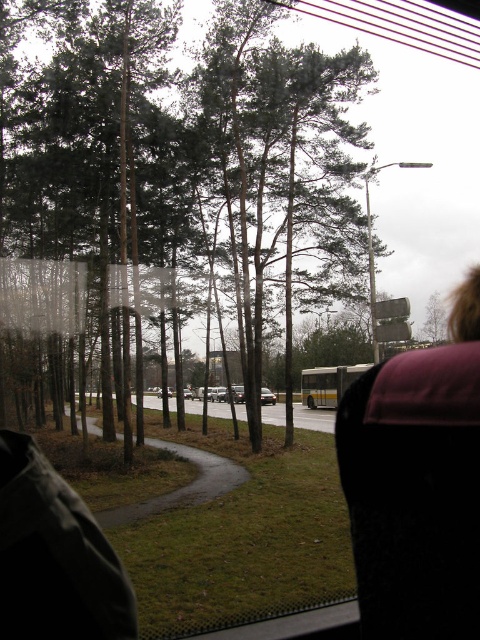
Question: Does maroon fabric at upper right have a larger size compared to yellow metallic bus at center?

Choices:
 (A) no
 (B) yes

Answer: (A)

Question: Which object is farther from the camera taking this photo?

Choices:
 (A) shiny silver sedan at center
 (B) maroon fabric at upper right

Answer: (A)

Question: Is yellow metallic bus at center in front of shiny silver sedan at center?

Choices:
 (A) no
 (B) yes

Answer: (A)

Question: Among these objects, which one is farthest from the camera?

Choices:
 (A) shiny silver sedan at center
 (B) yellow metallic bus at center

Answer: (B)

Question: Does maroon fabric at upper right appear on the right side of yellow metallic bus at center?

Choices:
 (A) yes
 (B) no

Answer: (B)

Question: Which of these objects is positioned closest to the maroon fabric at upper right?

Choices:
 (A) shiny silver sedan at center
 (B) yellow metallic bus at center

Answer: (A)